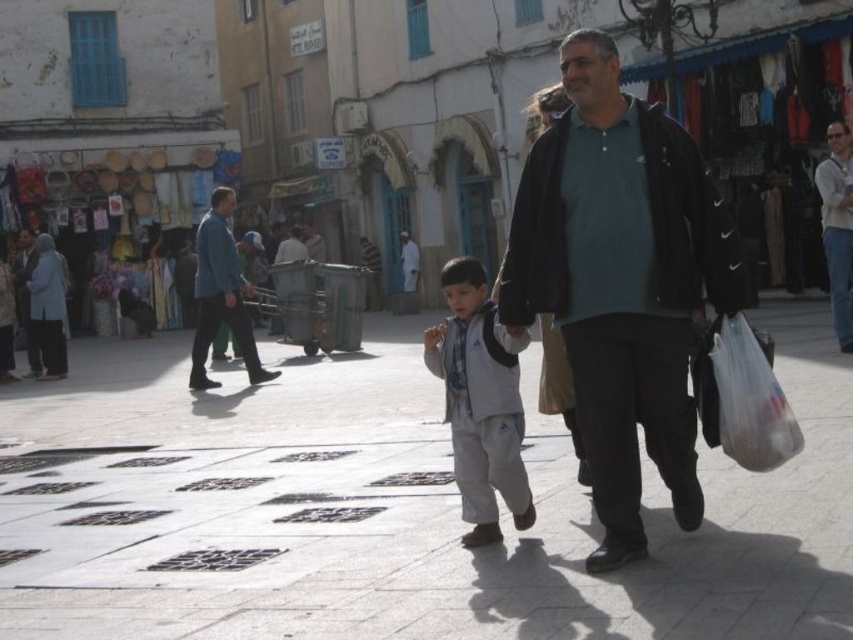
Question: Does dark green jersey at center appear over white matte jacket at center?

Choices:
 (A) no
 (B) yes

Answer: (B)

Question: Which of the following is the farthest from the observer?

Choices:
 (A) white concrete pavement at center
 (B) white matte jacket at center
 (C) light brown leather jacket at upper right

Answer: (C)

Question: Where is white matte jacket at center located in relation to blue cotton shirt at center in the image?

Choices:
 (A) right
 (B) left

Answer: (A)

Question: Does blue cotton shirt at center appear under light brown leather jacket at upper right?

Choices:
 (A) yes
 (B) no

Answer: (A)

Question: Which of the following is the farthest from the observer?

Choices:
 (A) (547, 282)
 (B) (462, 364)
 (C) (212, 269)

Answer: (C)

Question: Considering the real-world distances, which object is farthest from the white concrete pavement at center?

Choices:
 (A) light brown leather jacket at upper right
 (B) blue cotton shirt at center

Answer: (A)